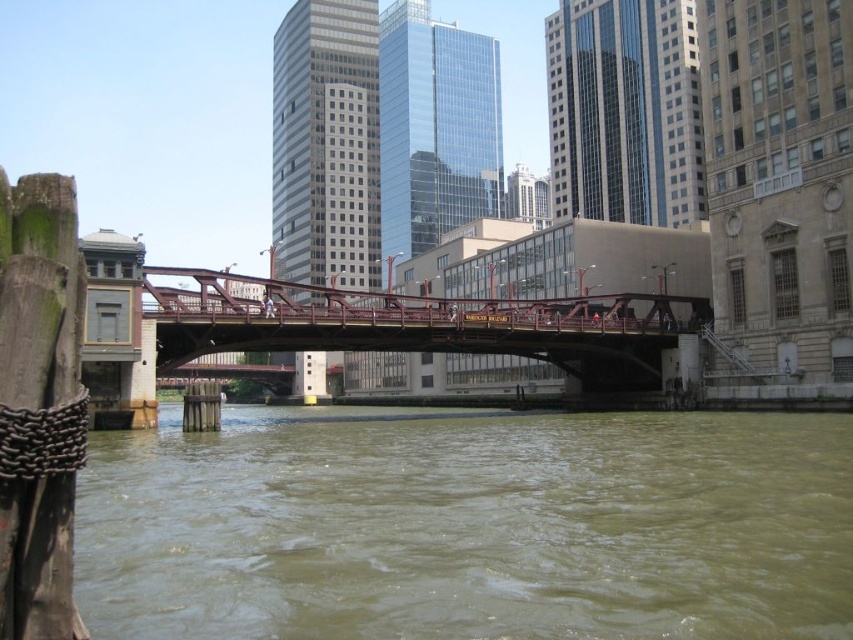
You are a delivery drone that needs to fly over the brown murky water at center and the rusty metal bridge at center. Which object requires you to ascend higher to avoid collision?

The brown murky water at center might be wider than the rusty metal bridge at center, so the drone should ascend higher to safely cross over the brown murky water at center.